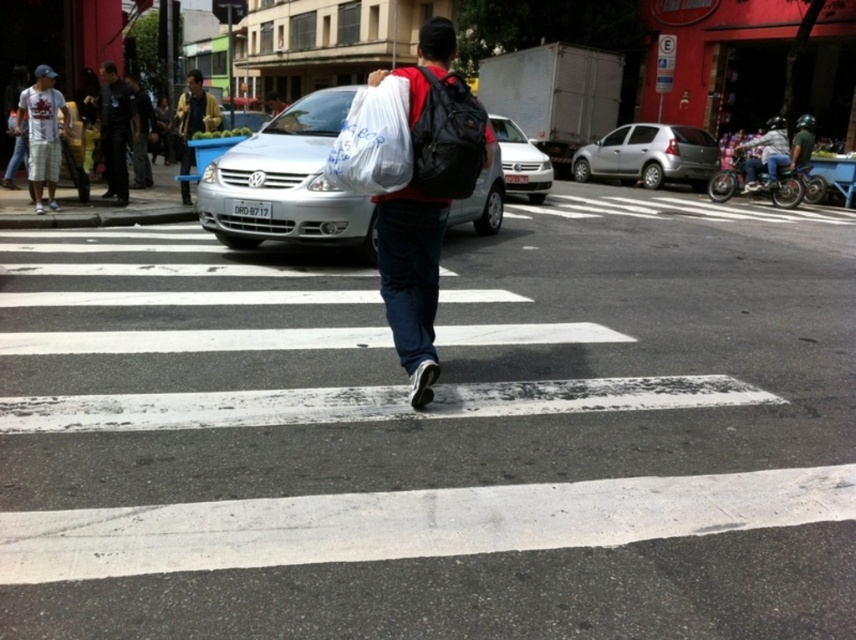
You are a delivery person who needs to deliver a package to the person crossing the crosswalk. You have a package that is 2.5 inches wide. Can you fit the package between the matte black backpack at center and the black fabric backpack at center?

The matte black backpack at center is 2.17 inches away from the black fabric backpack at center. Since the package is 2.5 inches wide, which is wider than the space between the two backpacks, the package cannot fit between them.

You are a delivery drone operator. Your drone is flying above the crosswalk and needs to deliver a package to the person crossing the street. The delivery must be made precisely at the location of the matte black backpack at center. What are the coordinates where you should drop the package?

The coordinates for the matte black backpack at center are at point (426, 196), so the package should be dropped there.